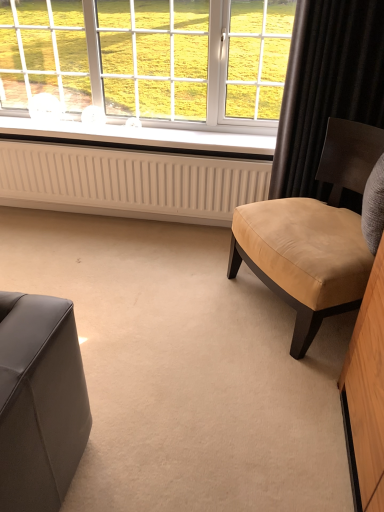
The height and width of the screenshot is (512, 384). I want to click on tan leather chair at right, so click(313, 236).

The height and width of the screenshot is (512, 384). What do you see at coordinates (142, 138) in the screenshot?
I see `white plastic window sill at center` at bounding box center [142, 138].

Where is `white plastic window sill at center`? white plastic window sill at center is located at coordinates (142, 138).

At what (x,y) coordinates should I click in order to perform the action: click on white ribbed radiator at center. Please return your answer as a coordinate pair (x, y). Looking at the image, I should click on (128, 181).

In order to click on tan leather chair at right in this screenshot , I will do `click(313, 236)`.

Is point (308, 4) less distant than point (302, 234)?

No, (308, 4) is further to viewer.

Considering the sizes of black velvet curtain at upper right and tan leather chair at right in the image, is black velvet curtain at upper right taller or shorter than tan leather chair at right?

black velvet curtain at upper right is taller than tan leather chair at right.

Can you confirm if black velvet curtain at upper right is thinner than tan leather chair at right?

Yes, black velvet curtain at upper right is thinner than tan leather chair at right.

Looking at this image, does black velvet curtain at upper right come behind tan leather chair at right?

Yes, black velvet curtain at upper right is further from the camera.

How many degrees apart are the facing directions of white plastic window sill at center and tan leather chair at right?

The angular difference between white plastic window sill at center and tan leather chair at right is 59.6 degrees.

Consider the image. Is white plastic window sill at center inside or outside of tan leather chair at right?

white plastic window sill at center lies outside tan leather chair at right.

Are white plastic window sill at center and tan leather chair at right making contact?

There is a gap between white plastic window sill at center and tan leather chair at right.

How different are the orientations of tan leather chair at right and black velvet curtain at upper right in degrees?

There is a 59.4-degree angle between the facing directions of tan leather chair at right and black velvet curtain at upper right.

From the image's perspective, would you say tan leather chair at right is shown under black velvet curtain at upper right?

Indeed, from the image's perspective, tan leather chair at right is shown beneath black velvet curtain at upper right.

Which object is further away from the camera taking this photo, tan leather chair at right or black velvet curtain at upper right?

black velvet curtain at upper right.

Considering the sizes of objects tan leather chair at right and black velvet curtain at upper right in the image provided, who is bigger, tan leather chair at right or black velvet curtain at upper right?

tan leather chair at right.

From the image's perspective, which object appears higher, white plastic window sill at center or black velvet curtain at upper right?

From the image's view, white plastic window sill at center is above.

Who is smaller, white plastic window sill at center or black velvet curtain at upper right?

Smaller between the two is white plastic window sill at center.

Find the location of a particular element. The image size is (384, 512). curtain located below the white plastic window sill at center (from the image's perspective) is located at coordinates click(x=327, y=85).

Is black velvet curtain at upper right at the back of white plastic window sill at center?

No, white plastic window sill at center's orientation is not away from black velvet curtain at upper right.

From a real-world perspective, is tan leather chair at right physically above white ribbed radiator at center?

Correct, in the physical world, tan leather chair at right is higher than white ribbed radiator at center.

Is tan leather chair at right facing towards white ribbed radiator at center?

No, tan leather chair at right is not turned towards white ribbed radiator at center.

Between tan leather chair at right and white ribbed radiator at center, which one has larger size?

tan leather chair at right.

Consider the image. Is tan leather chair at right inside the boundaries of white ribbed radiator at center, or outside?

tan leather chair at right cannot be found inside white ribbed radiator at center.

Based on the photo, choose the correct answer: Is black velvet curtain at upper right inside white plastic window at upper center or outside it?

black velvet curtain at upper right is outside white plastic window at upper center.

Is black velvet curtain at upper right oriented towards white plastic window at upper center?

No, black velvet curtain at upper right is not aimed at white plastic window at upper center.

From the image's perspective, is black velvet curtain at upper right under white plastic window at upper center?

Correct, black velvet curtain at upper right appears lower than white plastic window at upper center in the image.

What's the angular difference between black velvet curtain at upper right and white plastic window at upper center's facing directions?

The angle between the facing direction of black velvet curtain at upper right and the facing direction of white plastic window at upper center is 0.218 degrees.

Consider the image. How many degrees apart are the facing directions of white plastic window sill at center and white ribbed radiator at center?

The angle between the facing direction of white plastic window sill at center and the facing direction of white ribbed radiator at center is 0.824 degrees.

What are the coordinates of `radiator located below the white plastic window sill at center (from the image's perspective)` in the screenshot? It's located at (128, 181).

Is white plastic window sill at center touching white ribbed radiator at center?

white plastic window sill at center and white ribbed radiator at center are not in contact.

Is white plastic window sill at center looking in the opposite direction of white ribbed radiator at center?

That's not correct — white plastic window sill at center is not looking away from white ribbed radiator at center.

Where is `chair lying in front of the black velvet curtain at upper right`? The width and height of the screenshot is (384, 512). chair lying in front of the black velvet curtain at upper right is located at coordinates (313, 236).

Locate an element on the screen. The image size is (384, 512). window sill located above the tan leather chair at right (from a real-world perspective) is located at coordinates (142, 138).

Based on the photo, from the image, which object appears to be farther from white plastic window sill at center, black velvet curtain at upper right or white plastic window at upper center?

Based on the image, white plastic window at upper center appears to be further to white plastic window sill at center.

Estimate the real-world distances between objects in this image. Which object is closer to white plastic window sill at center, white plastic window at upper center or tan leather chair at right?

tan leather chair at right lies closer to white plastic window sill at center than the other object.

Consider the image. Which object lies nearer to the anchor point black velvet curtain at upper right, white plastic window sill at center or white plastic window at upper center?

The object closer to black velvet curtain at upper right is white plastic window sill at center.

Estimate the real-world distances between objects in this image. Which object is further from tan leather chair at right, white plastic window at upper center or black velvet curtain at upper right?

The object further to tan leather chair at right is white plastic window at upper center.

Which object lies nearer to the anchor point tan leather chair at right, white plastic window sill at center or white plastic window at upper center?

Based on the image, white plastic window sill at center appears to be nearer to tan leather chair at right.

Which object lies further to the anchor point white ribbed radiator at center, tan leather chair at right or white plastic window at upper center?

Based on the image, white plastic window at upper center appears to be further to white ribbed radiator at center.

When comparing their distances from tan leather chair at right, does white plastic window at upper center or white plastic window sill at center seem further?

white plastic window at upper center.

When comparing their distances from tan leather chair at right, does black velvet curtain at upper right or white plastic window at upper center seem further?

white plastic window at upper center lies further to tan leather chair at right than the other object.

Where is `window between white plastic window sill at center and tan leather chair at right from left to right`? This screenshot has height=512, width=384. window between white plastic window sill at center and tan leather chair at right from left to right is located at coordinates (148, 61).

Image resolution: width=384 pixels, height=512 pixels. Identify the location of radiator between white plastic window sill at center and black velvet curtain at upper right. (128, 181).

Locate an element on the screen. chair between white plastic window sill at center and black velvet curtain at upper right is located at coordinates (313, 236).

This screenshot has height=512, width=384. I want to click on radiator between white plastic window at upper center and tan leather chair at right from left to right, so click(128, 181).